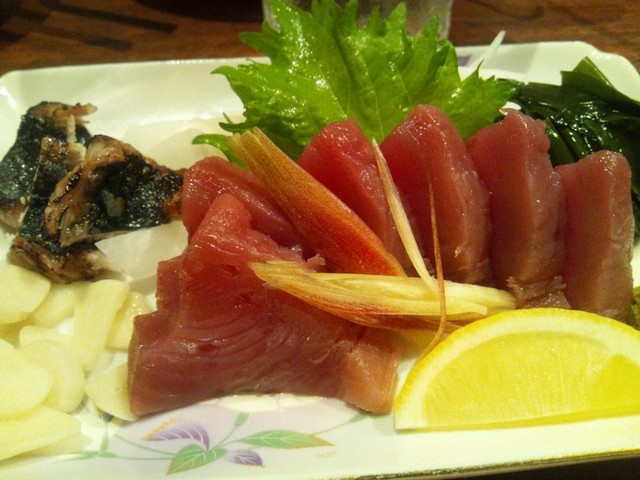
This screenshot has height=480, width=640. Find the location of `white plate`. white plate is located at coordinates (332, 454).